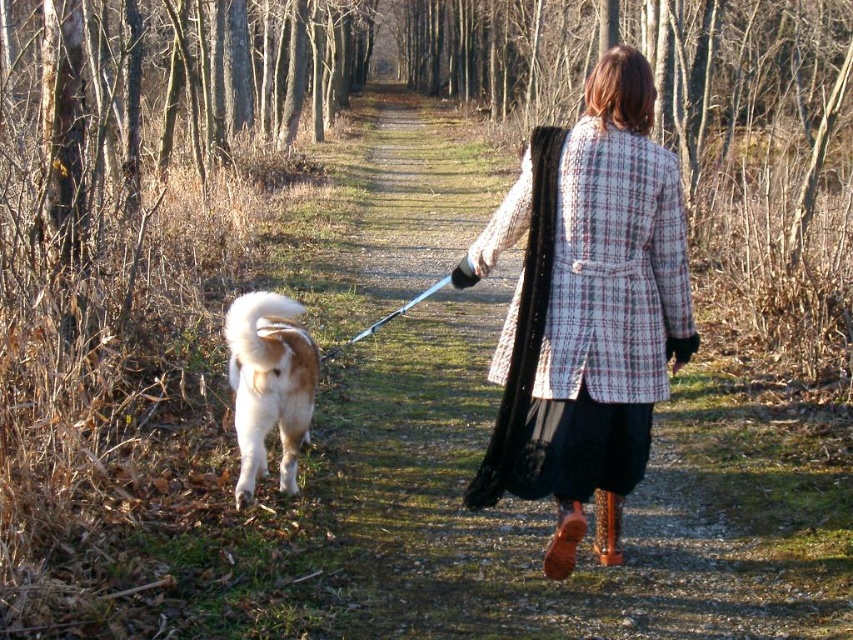
Question: Is gravel path at center below plaid wool coat at center?

Choices:
 (A) no
 (B) yes

Answer: (A)

Question: Which point appears farthest from the camera in this image?

Choices:
 (A) (575, 496)
 (B) (231, 316)

Answer: (B)

Question: Can you confirm if gravel path at center is thinner than plaid wool coat at center?

Choices:
 (A) no
 (B) yes

Answer: (A)

Question: Which of the following is the farthest from the observer?

Choices:
 (A) fluffy white fur at lower left
 (B) plaid wool coat at center

Answer: (A)

Question: From the image, what is the correct spatial relationship of gravel path at center in relation to fluffy white fur at lower left?

Choices:
 (A) right
 (B) left

Answer: (B)

Question: Which point is closer to the camera?

Choices:
 (A) gravel path at center
 (B) fluffy white fur at lower left

Answer: (A)